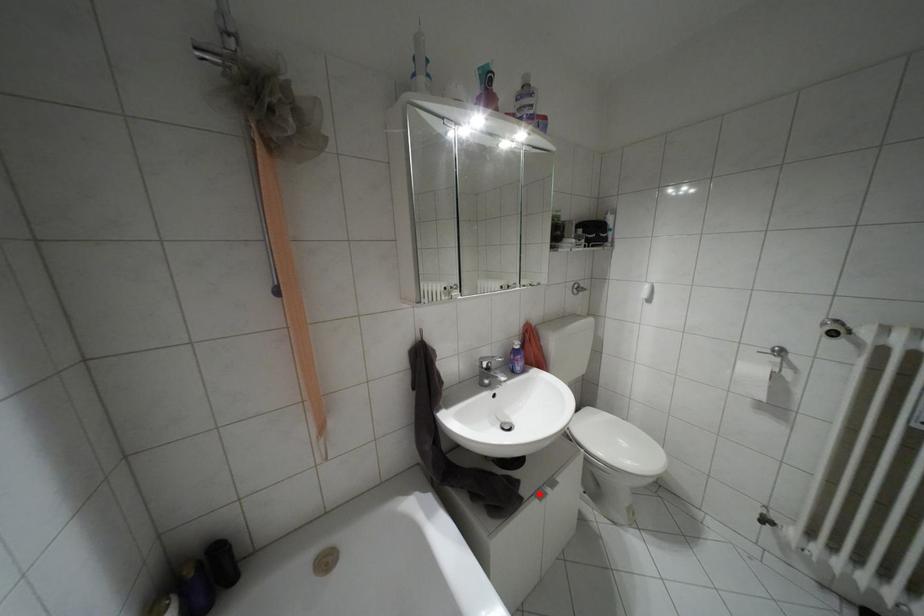
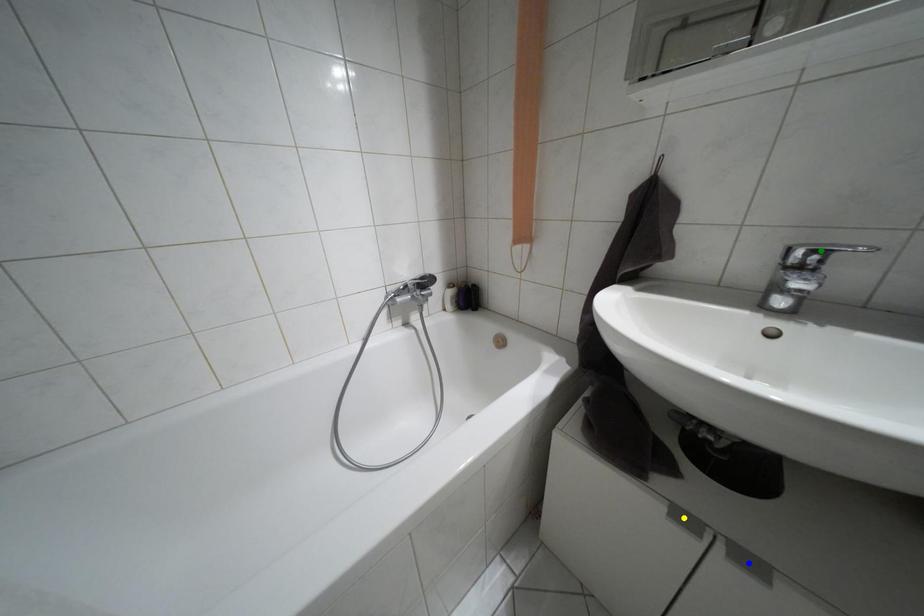
Question: I am providing you with two images of the same scene from different viewpoints. A red point is marked on the first image. You are given multiple points on the second image. Can you choose the point in image 2 that corresponds to the point in image 1?

Choices:
 (A) blue point
 (B) yellow point
 (C) green point

Answer: (B)